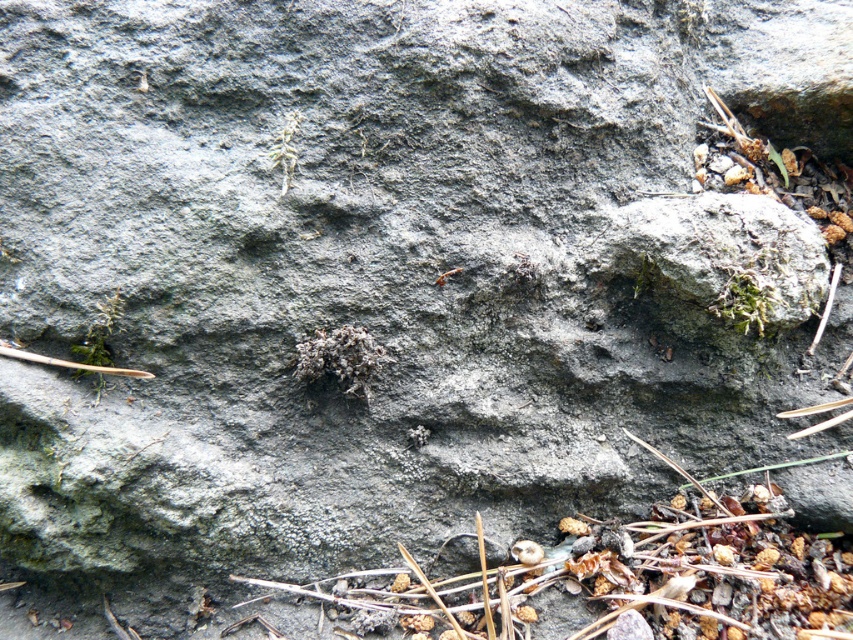
Question: Can you confirm if fuzzy grayish-brown weed at center is smaller than green mossy weed at upper center?

Choices:
 (A) yes
 (B) no

Answer: (B)

Question: In this image, where is fuzzy grayish-brown weed at center located relative to green mossy weed at upper center?

Choices:
 (A) left
 (B) right

Answer: (B)

Question: Which object appears farthest from the camera in this image?

Choices:
 (A) green mossy weed at upper center
 (B) fuzzy grayish-brown weed at center

Answer: (A)

Question: Is fuzzy grayish-brown weed at center thinner than green mossy weed at upper center?

Choices:
 (A) no
 (B) yes

Answer: (A)

Question: Which of the following is the closest to the observer?

Choices:
 (A) (357, 349)
 (B) (291, 113)

Answer: (A)

Question: Which point appears farthest from the camera in this image?

Choices:
 (A) coord(311,353)
 (B) coord(299,118)

Answer: (B)